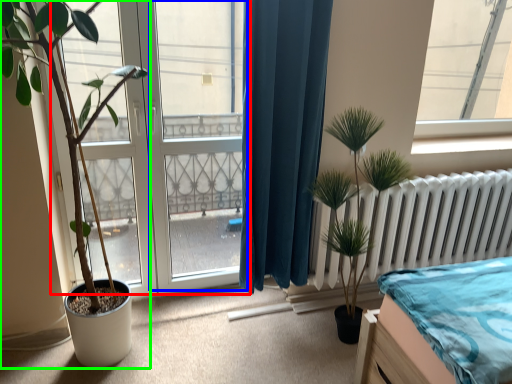
Question: Which object is the closest to the bay window (highlighted by a red box)? Choose among these: screen door (highlighted by a blue box) or houseplant (highlighted by a green box).

Choices:
 (A) screen door
 (B) houseplant

Answer: (A)